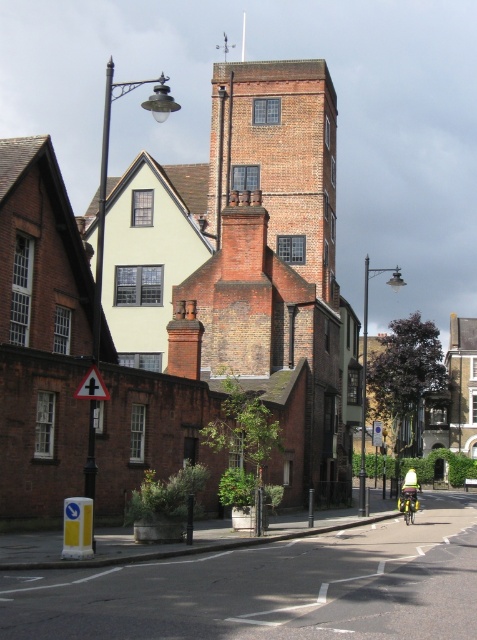
You are a delivery person who needs to place both the green fabric helmet at center and the blue plastic sign at center on a shelf that can only hold items up to 30 cm in width. Which item should you place first to ensure both fit?

The green fabric helmet at center has a larger width than the blue plastic sign at center. To ensure both fit on the shelf, you should place the green fabric helmet at center first, then the blue plastic sign at center.

You are standing on the street in the historic area and want to reach a specific location marked at point (415, 497). If your walking speed is 1.5 meters per second, how many seconds will it take you to reach that point?

The distance between you and point (415, 497) is 30.09 meters. At a speed of 1.5 meters per second, it will take approximately 20.06 seconds to reach the point.

You are standing at the edge of the street and see a green fabric helmet at center and a blue plastic sign at center. If you want to reach both items, which one would you need to walk further to get to?

The green fabric helmet at center is 9.90 meters away from the blue plastic sign at center. Since you are at the edge of the street, you need to walk 9.90 meters to reach either item. However, since both are at the same central position, the distance to both is the same.